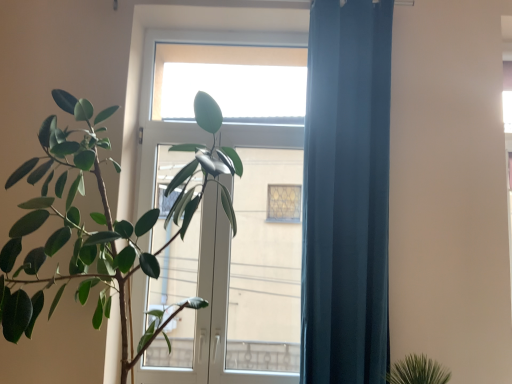
Question: Does dark blue fabric curtain at right come in front of green matte plant at left?

Choices:
 (A) yes
 (B) no

Answer: (B)

Question: Is dark blue fabric curtain at right shorter than green matte plant at left?

Choices:
 (A) no
 (B) yes

Answer: (A)

Question: From the image's perspective, is dark blue fabric curtain at right above green matte plant at left?

Choices:
 (A) no
 (B) yes

Answer: (B)

Question: From the image's perspective, is dark blue fabric curtain at right located beneath green matte plant at left?

Choices:
 (A) yes
 (B) no

Answer: (B)

Question: Would you consider dark blue fabric curtain at right to be distant from green matte plant at left?

Choices:
 (A) yes
 (B) no

Answer: (B)

Question: Is dark blue fabric curtain at right taller than green matte plant at left?

Choices:
 (A) no
 (B) yes

Answer: (B)

Question: Is transparent glass window at upper center facing away from transparent glass screen door at center?

Choices:
 (A) yes
 (B) no

Answer: (A)

Question: Does transparent glass window at upper center appear on the left side of transparent glass screen door at center?

Choices:
 (A) yes
 (B) no

Answer: (A)

Question: From the image's perspective, is transparent glass window at upper center below transparent glass screen door at center?

Choices:
 (A) yes
 (B) no

Answer: (B)

Question: Is transparent glass window at upper center next to transparent glass screen door at center?

Choices:
 (A) no
 (B) yes

Answer: (A)

Question: From the image's perspective, does transparent glass window at upper center appear higher than transparent glass screen door at center?

Choices:
 (A) yes
 (B) no

Answer: (A)

Question: From a real-world perspective, does transparent glass window at upper center stand above transparent glass screen door at center?

Choices:
 (A) no
 (B) yes

Answer: (B)

Question: Does dark blue fabric curtain at right have a greater height compared to transparent glass screen door at center?

Choices:
 (A) yes
 (B) no

Answer: (B)